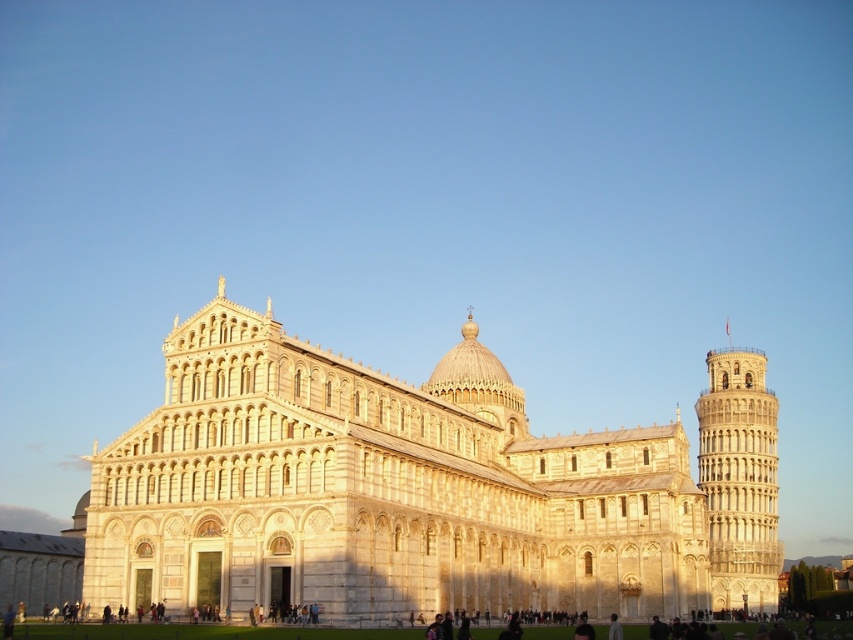
You are standing in the Piazza dei Miracoli and want to take a photo of the white stone cathedral at center. If your camera can focus on objects up to 50 meters away, will you need to move closer to capture a clear image?

The white stone cathedral at center is 53.84 meters away from the camera, which exceeds the camera focus range of 50 meters. Therefore, you need to move closer to ensure the white stone cathedral at center is within the focus range.

You are a tourist standing in the Piazza dei Miracoli in Pisa, Italy. You want to take a photo that includes both the white stone cathedral at center and the white stone tower at right. The camera you have can capture a maximum width of 12 meters. Can you fit both landmarks in the frame without moving closer or farther away?

The white stone cathedral at center and white stone tower at right are 10.27 meters apart. Since the distance between them is less than the camera maximum width of 12 meters, you can fit both landmarks in the frame without moving closer or farther away.

Consider the image. You are a tourist visiting the Piazza dei Miracoli in Pisa. You have a photo of the scene and want to know which of the two landmarks, the white stone cathedral at center or the white stone tower at right, is taller. Can you determine this based on the image?

The white stone cathedral at center is much taller than the white stone tower at right, so the cathedral is the taller one.